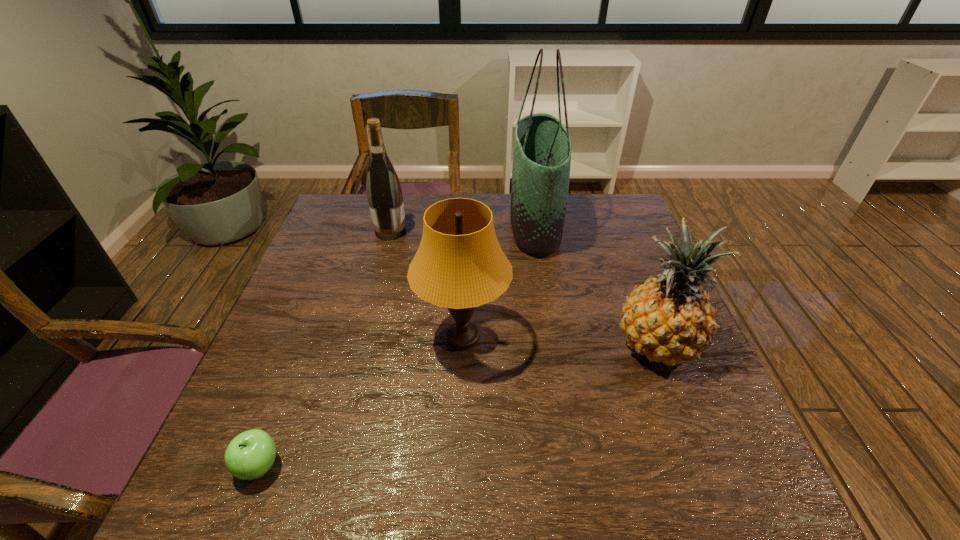
The image size is (960, 540). Find the location of `vacant space located on the back of the rightmost object`. vacant space located on the back of the rightmost object is located at coordinates (637, 296).

Locate an element on the screen. free space located 0.280m on the right of the leftmost object is located at coordinates (438, 466).

You are a GUI agent. You are given a task and a screenshot of the screen. Output one action in this format:
    pyautogui.click(x=<x>, y=<y>)
    Task: Click on the tote bag that is at the far edge
    Image resolution: width=960 pixels, height=540 pixels.
    Given the screenshot: What is the action you would take?
    pyautogui.click(x=542, y=146)

Identify the location of wine bottle at the far edge. (384, 193).

Where is `object located in the near edge section of the desktop`? The height and width of the screenshot is (540, 960). object located in the near edge section of the desktop is located at coordinates click(x=249, y=455).

At what (x,y) coordinates should I click in order to perform the action: click on object situated at the left edge. Please return your answer as a coordinate pair (x, y). The image size is (960, 540). Looking at the image, I should click on pyautogui.click(x=249, y=455).

Where is `object present at the right edge`? object present at the right edge is located at coordinates (669, 319).

Where is `object present at the near left corner`? Image resolution: width=960 pixels, height=540 pixels. object present at the near left corner is located at coordinates (249, 455).

You are a GUI agent. You are given a task and a screenshot of the screen. Output one action in this format:
    pyautogui.click(x=<x>, y=<y>)
    Task: Click on the free space at the far edge of the desktop
    
    Given the screenshot: What is the action you would take?
    pyautogui.click(x=500, y=199)

This screenshot has height=540, width=960. I want to click on vacant space at the left edge, so click(348, 265).